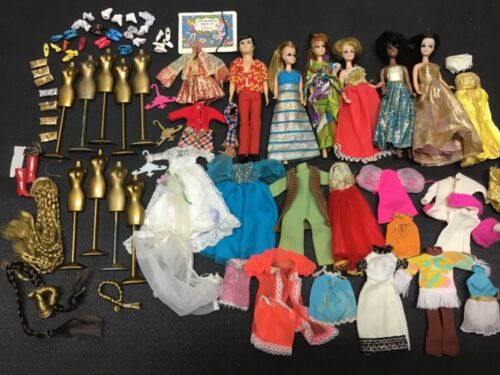
The image size is (500, 375). What are the coordinates of `doll mannequins` in the screenshot? It's located at (68, 79), (91, 79), (106, 74), (129, 76), (139, 72), (75, 180), (97, 172), (118, 180), (134, 192).